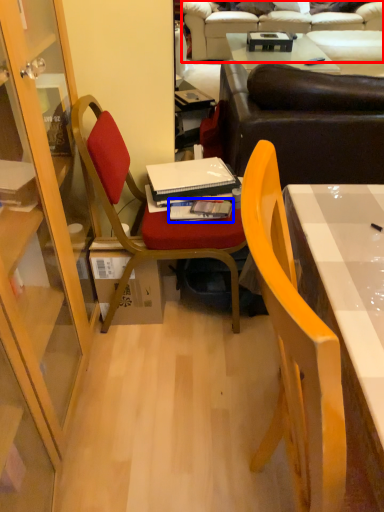
Question: Among these objects, which one is nearest to the camera, studio couch (highlighted by a red box) or book (highlighted by a blue box)?

Choices:
 (A) studio couch
 (B) book

Answer: (B)